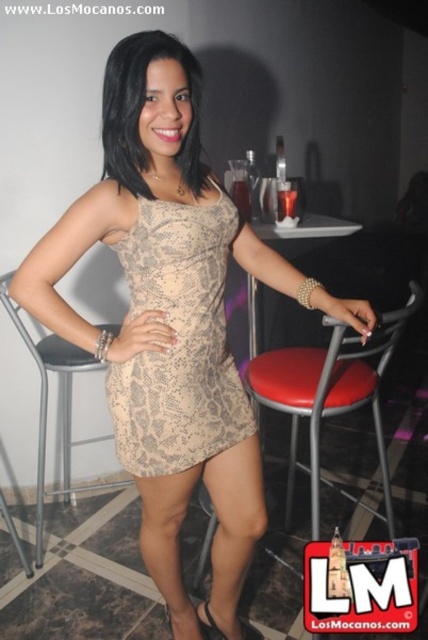
Question: Is snake skin beige dress at center thinner than red leather stool at center?

Choices:
 (A) yes
 (B) no

Answer: (A)

Question: Estimate the real-world distances between objects in this image. Which object is farther from the snake skin beige dress at center?

Choices:
 (A) black leather stool at center
 (B) red leather stool at center

Answer: (A)

Question: Which point is closer to the camera?

Choices:
 (A) snake skin beige dress at center
 (B) red leather stool at center

Answer: (A)

Question: Which of the following is the closest to the observer?

Choices:
 (A) (315, 448)
 (B) (38, 492)

Answer: (A)

Question: Is red leather stool at center further to camera compared to black leather stool at center?

Choices:
 (A) yes
 (B) no

Answer: (B)

Question: Does red leather stool at center appear on the right side of black leather stool at center?

Choices:
 (A) no
 (B) yes

Answer: (B)